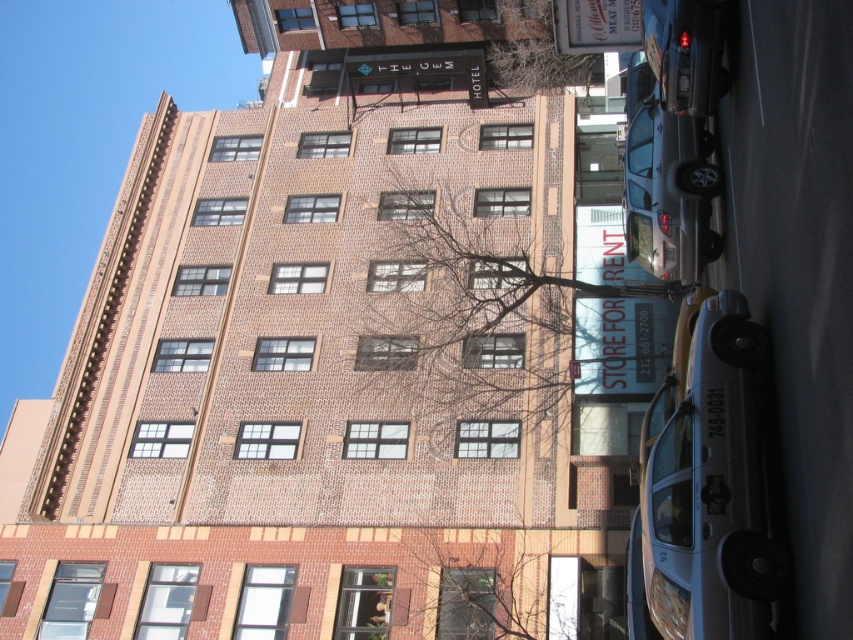
Between metallic silver taxi at lower right and shiny black car at upper right, which one has more height?

With more height is metallic silver taxi at lower right.

Is metallic silver taxi at lower right closer to the viewer compared to shiny black car at upper right?

Yes, metallic silver taxi at lower right is closer to the viewer.

You are a GUI agent. You are given a task and a screenshot of the screen. Output one action in this format:
    pyautogui.click(x=<x>, y=<y>)
    Task: Click on the metallic silver taxi at lower right
    
    Given the screenshot: What is the action you would take?
    pyautogui.click(x=711, y=481)

Is shiny black car at upper right below bare branches at upper center?

Indeed, shiny black car at upper right is positioned under bare branches at upper center.

Identify the location of shiny black car at upper right. (686, 52).

Is bare branches at center in front of white plastic sign at upper center?

That is True.

Is bare branches at center thinner than white plastic sign at upper center?

Correct, bare branches at center's width is less than white plastic sign at upper center's.

Describe the element at coordinates (482, 580) in the screenshot. I see `bare branches at center` at that location.

The height and width of the screenshot is (640, 853). What are the coordinates of `bare branches at center` in the screenshot? It's located at (482, 580).